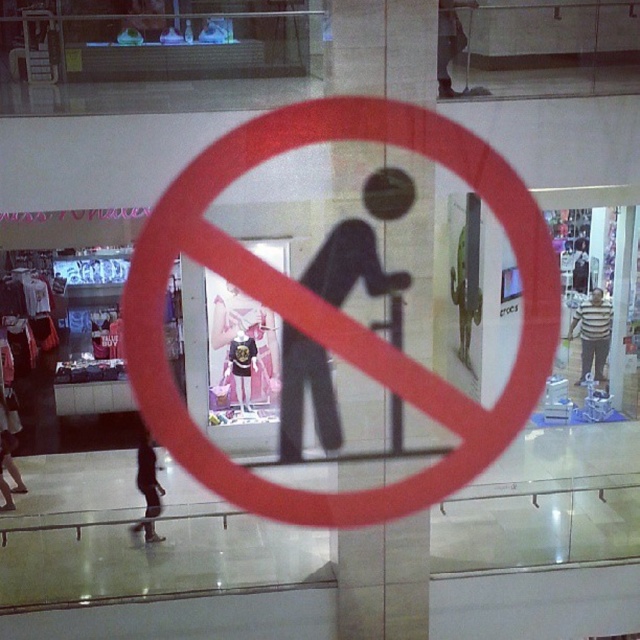
Consider the image. Who is more distant from viewer, (573, 323) or (163, 490)?

Positioned behind is point (573, 323).

Who is shorter, striped shirt at center or dark gray pants at lower left?

dark gray pants at lower left

Is point (595, 332) positioned behind point (150, 460)?

Yes, it is behind point (150, 460).

I want to click on striped shirt at center, so click(x=593, y=333).

Does black matte figure at center lie in front of dark gray pants at lower left?

Yes.

Does point (376, 268) come behind point (145, 525)?

No, it is not.

Describe the element at coordinates (304, 394) in the screenshot. The width and height of the screenshot is (640, 640). I see `black matte figure at center` at that location.

This screenshot has height=640, width=640. Identify the location of black matte figure at center. (304, 394).

Who is taller, black matte pillar at center or black matte figure at center?

With more height is black matte figure at center.

Is black matte pillar at center positioned behind black matte figure at center?

No, black matte pillar at center is closer to the viewer.

From the picture: Who is more forward, [340,163] or [323,266]?

Point [340,163] is more forward.

Where is `black matte pillar at center`? Image resolution: width=640 pixels, height=640 pixels. black matte pillar at center is located at coordinates (384, 580).